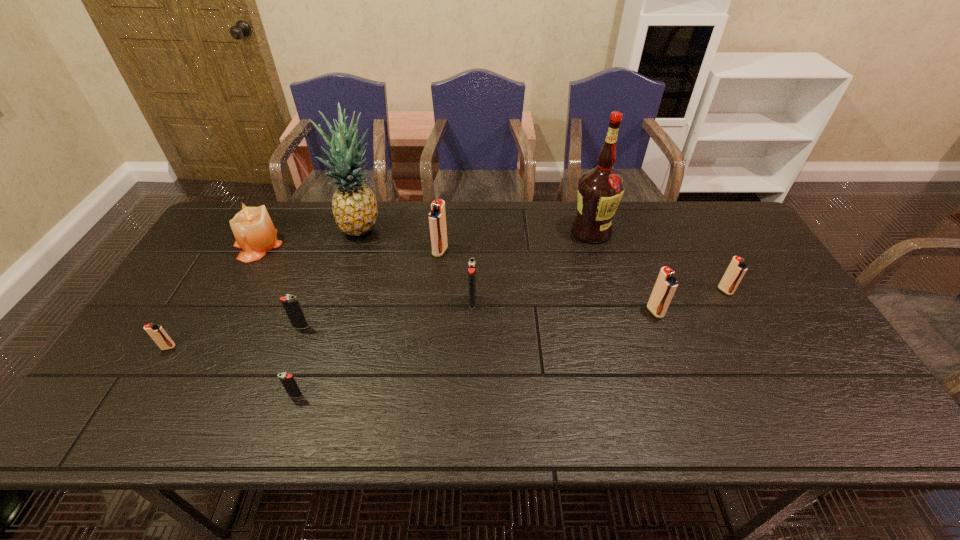
Image resolution: width=960 pixels, height=540 pixels. What are the coordinates of `the second nearest black igniter` in the screenshot? It's located at (291, 305).

Locate an element on the screen. This screenshot has height=540, width=960. the fifth farthest igniter is located at coordinates [x=291, y=305].

I want to click on the third nearest red igniter, so click(x=736, y=269).

Identify the location of the second smallest red igniter. (736, 269).

At what (x,y) coordinates should I click in order to perform the action: click on the leftmost igniter. Please return your answer as a coordinate pair (x, y). Looking at the image, I should click on (156, 332).

The width and height of the screenshot is (960, 540). Find the location of `the nearest red igniter`. the nearest red igniter is located at coordinates (156, 332).

The image size is (960, 540). What are the coordinates of `the nearest igniter` in the screenshot? It's located at (287, 380).

The width and height of the screenshot is (960, 540). I want to click on the nearest black igniter, so click(x=287, y=380).

You are a GUI agent. You are given a task and a screenshot of the screen. Output one action in this format:
    pyautogui.click(x=<x>, y=<y>)
    Task: Click on the vacant region located on the front of the pineapple
    
    Given the screenshot: What is the action you would take?
    (348, 272)

Locate an element on the screen. The width and height of the screenshot is (960, 540). free space located on the label of the brown alcohol is located at coordinates (619, 330).